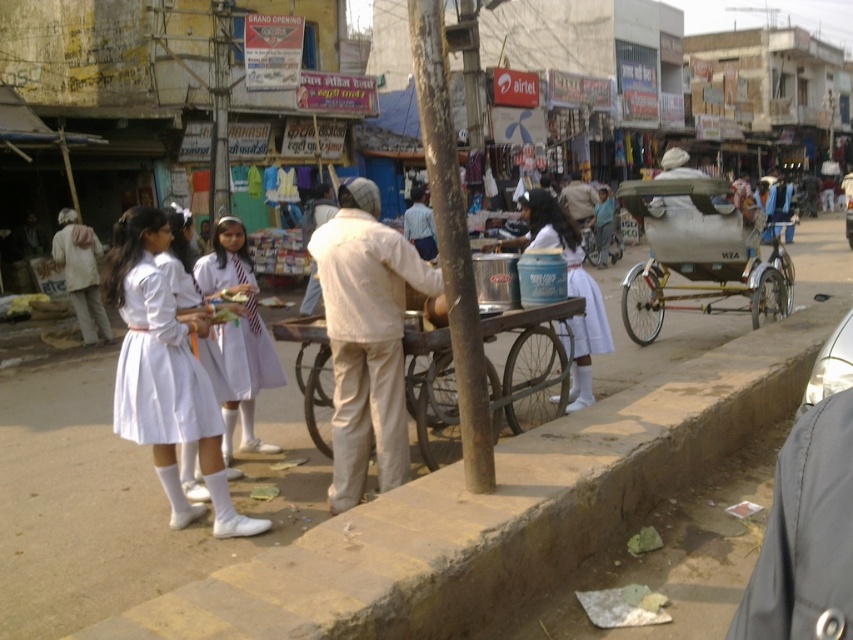
Question: Does metallic silver rickshaw at right lie behind white fabric dress at center?

Choices:
 (A) no
 (B) yes

Answer: (B)

Question: Does white uniform at center have a greater width compared to white fabric dress at center?

Choices:
 (A) no
 (B) yes

Answer: (A)

Question: Estimate the real-world distances between objects in this image. Which object is closer to the white uniform at center?

Choices:
 (A) smooth concrete curb at lower center
 (B) gray fabric coat at lower right

Answer: (A)

Question: Based on their relative distances, which object is nearer to the metallic silver cart at center?

Choices:
 (A) white cotton dress at left
 (B) gray fabric coat at lower right
 (C) white fabric dress at center
 (D) smooth concrete curb at lower center

Answer: (C)

Question: From the image, what is the correct spatial relationship of white uniform dress at lower left in relation to metallic silver cart at center?

Choices:
 (A) right
 (B) left

Answer: (B)

Question: Which point is closer to the camera?

Choices:
 (A) smooth concrete curb at lower center
 (B) white cotton dress at left

Answer: (A)